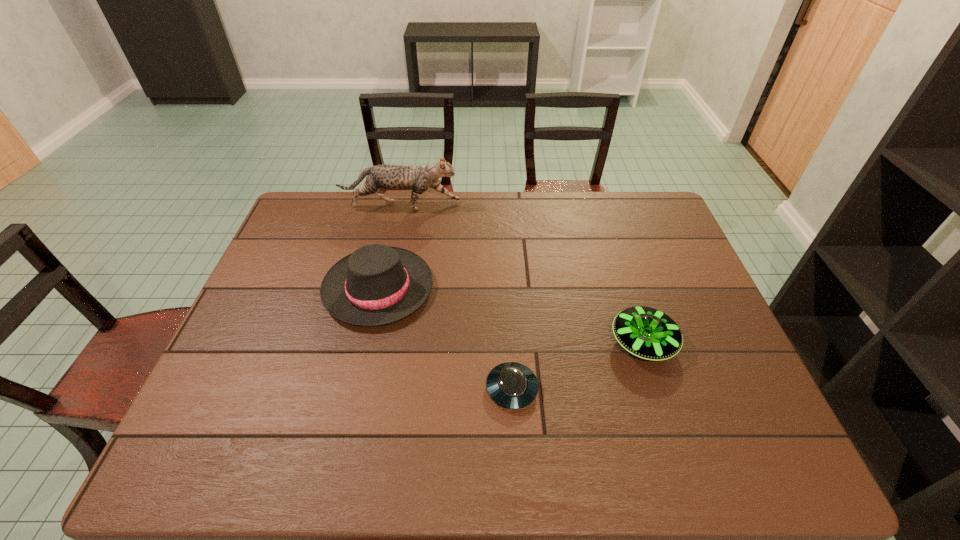
Locate an element on the screen. This screenshot has height=540, width=960. free spot at the far right corner of the desktop is located at coordinates (635, 223).

This screenshot has height=540, width=960. I want to click on vacant point located between the cat and the second shortest object, so click(x=521, y=274).

This screenshot has width=960, height=540. Identify the location of vacant space that is in between the third shortest object and the rightmost object. (511, 315).

The width and height of the screenshot is (960, 540). Identify the location of empty location between the right saucer and the second object from right to left. (578, 366).

This screenshot has height=540, width=960. Find the location of `vacant space that's between the shortest object and the farthest object`. vacant space that's between the shortest object and the farthest object is located at coordinates (456, 298).

Identify the location of unoccupied area between the second shortest object and the cat. The image size is (960, 540). (521, 274).

This screenshot has width=960, height=540. In order to click on object that is the nearest to the second object from right to left in this screenshot , I will do `click(375, 285)`.

The height and width of the screenshot is (540, 960). What are the coordinates of `object that is the second closest to the tallest object` in the screenshot? It's located at (648, 333).

At what (x,y) coordinates should I click in order to perform the action: click on free spot that satisfies the following two spatial constraints: 1. on the face of the farthest object; 2. on the front side of the dress hat. Please return your answer as a coordinate pair (x, y). This screenshot has width=960, height=540. Looking at the image, I should click on (383, 288).

Where is `free location that satisfies the following two spatial constraints: 1. on the front side of the shorter saucer; 2. on the right side of the second tallest object`? free location that satisfies the following two spatial constraints: 1. on the front side of the shorter saucer; 2. on the right side of the second tallest object is located at coordinates (356, 389).